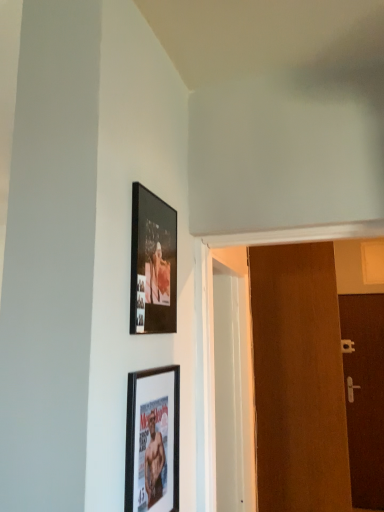
Question: From the image's perspective, relative to matte black picture frame at upper center, placed as the 1th picture frame when sorted from top to bottom, is brown matte door at right, positioned as the second door in front-to-back order, above or below?

Choices:
 (A) above
 (B) below

Answer: (B)

Question: Does point (375, 365) appear closer or farther from the camera than point (135, 209)?

Choices:
 (A) closer
 (B) farther

Answer: (B)

Question: Considering the real-world distances, which object is closest to the matte black picture frame at lower center, marked as the 2th picture frame in a top-to-bottom arrangement?

Choices:
 (A) brown wooden door at right, positioned as the 1th door in left-to-right order
 (B) matte black picture frame at upper center, the 2th picture frame in the bottom-to-top sequence
 (C) brown matte door at right, positioned as the second door in front-to-back order

Answer: (B)

Question: Based on their relative distances, which object is nearer to the brown wooden door at right, marked as the 2th door in a back-to-front arrangement?

Choices:
 (A) matte black picture frame at lower center, marked as the 2th picture frame in a top-to-bottom arrangement
 (B) brown matte door at right, positioned as the second door in front-to-back order
 (C) matte black picture frame at upper center, the 2th picture frame in the bottom-to-top sequence

Answer: (A)